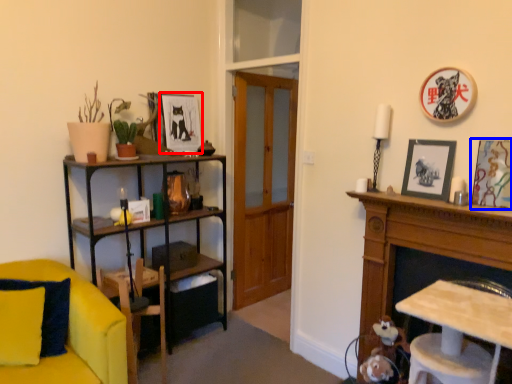
Question: Which object is further to the camera taking this photo, picture frame (highlighted by a red box) or picture frame (highlighted by a blue box)?

Choices:
 (A) picture frame
 (B) picture frame

Answer: (A)